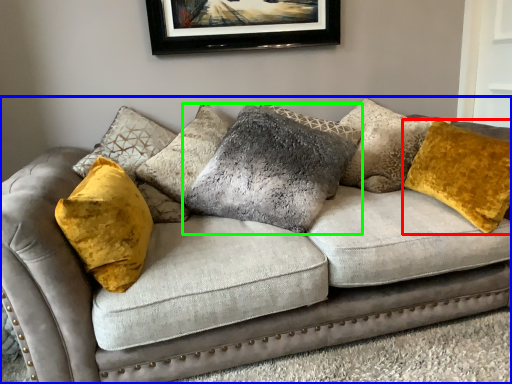
Question: Which object is positioned closest to pillow (highlighted by a red box)? Select from studio couch (highlighted by a blue box) and pillow (highlighted by a green box).

Choices:
 (A) studio couch
 (B) pillow

Answer: (A)